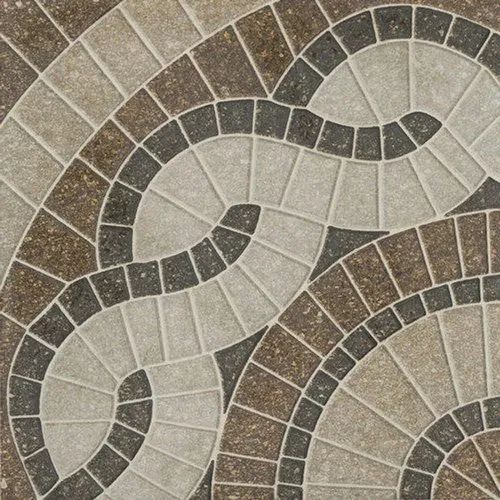
Identify the location of narrow section of light gray tile on right border of image. (493, 343).